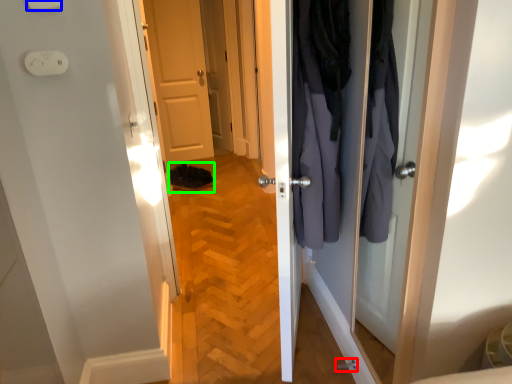
Question: Considering the real-world distances, which object is closest to door handle (highlighted by a red box)? light switch (highlighted by a blue box) or shoe (highlighted by a green box).

Choices:
 (A) light switch
 (B) shoe

Answer: (A)